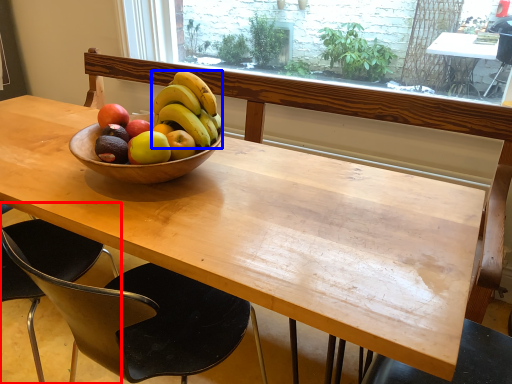
Question: Among these objects, which one is farthest to the camera, chair (highlighted by a red box) or banana (highlighted by a blue box)?

Choices:
 (A) chair
 (B) banana

Answer: (B)